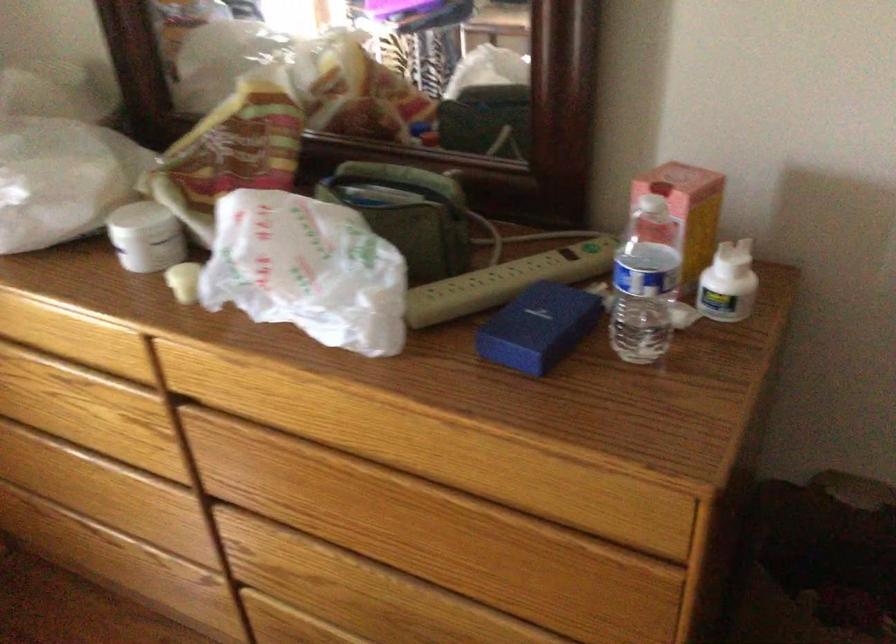
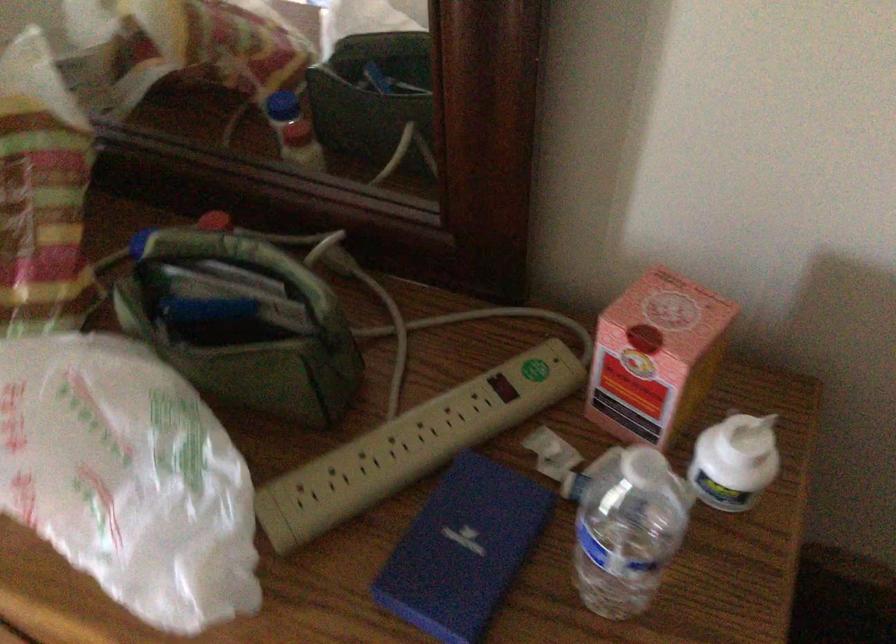
Where in the second image is the point corresponding to point (538, 319) from the first image?

(462, 550)